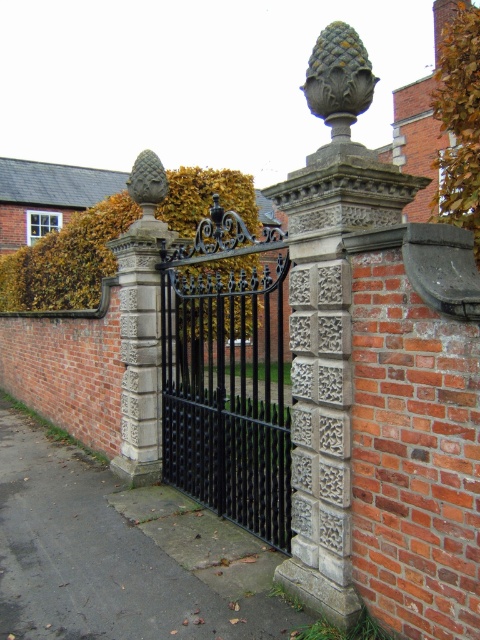
You are standing in front of the brick wall and want to enter through the gate. There are two objects in front of you, the black wrought iron gate at center and the stone textured acorn at center. Which object should you approach first to pass through the gate?

The black wrought iron gate at center is to the left of the stone textured acorn at center, so you should approach the black wrought iron gate at center first to pass through the gate.

You are a delivery person with a cart that is 2 meters wide. You need to deliver a package through the gate. Can your cart fit through the gap between the black wrought iron gate at center and the stone textured acorn at center?

The gap between the black wrought iron gate at center and the stone textured acorn at center is 6.19 meters. Since the cart is only 2 meters wide, it can easily fit through the gap.